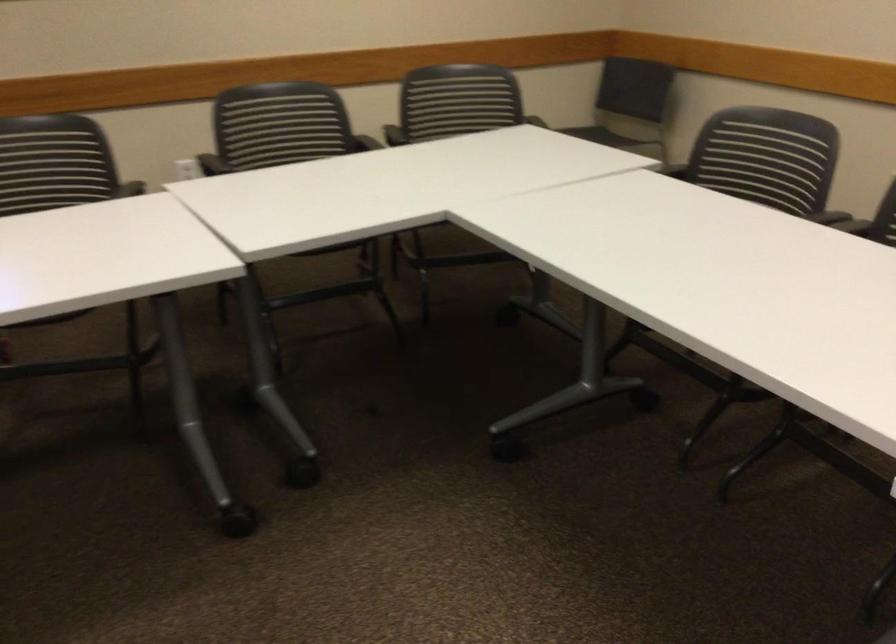
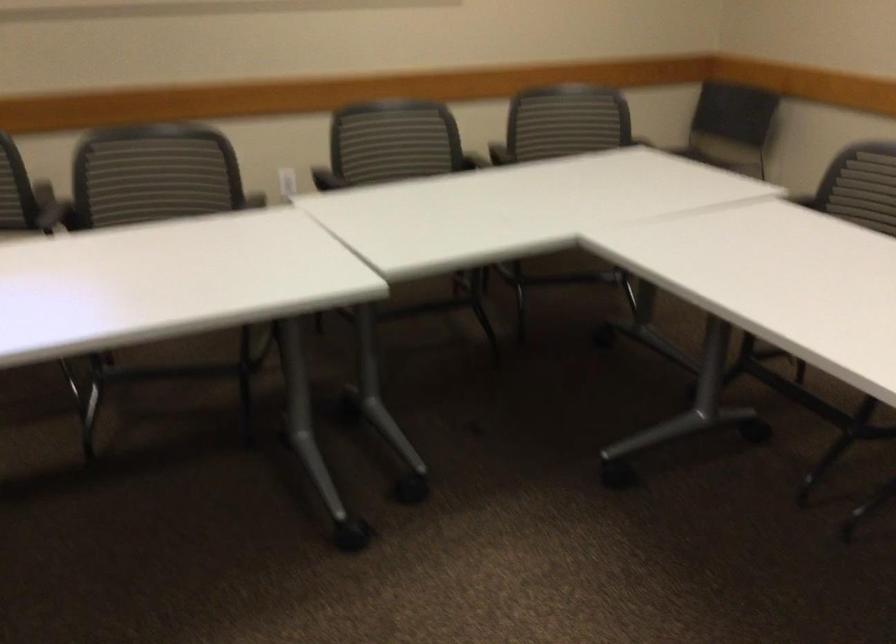
The point at (343,134) is marked in the first image. Where is the corresponding point in the second image?

(458, 151)